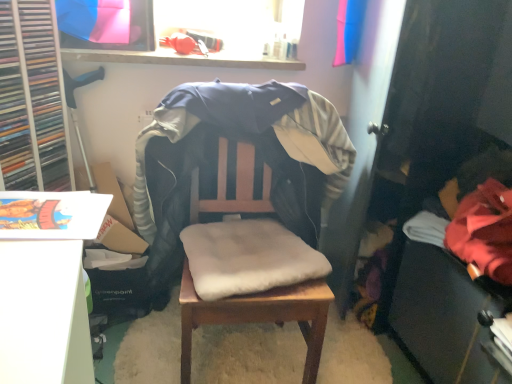
In order to click on free space above wooden table at center (from a real-world perspective) in this screenshot , I will do (250, 351).